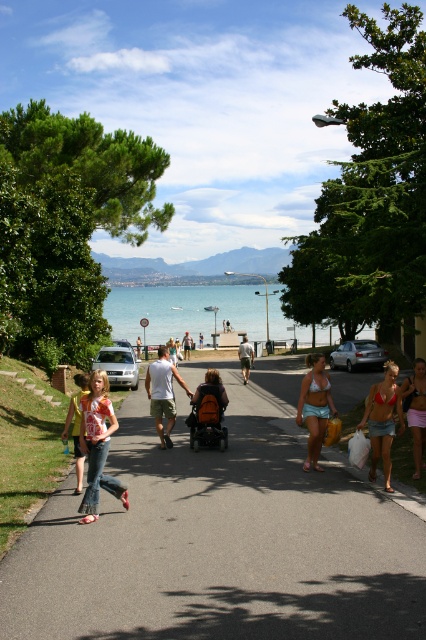
You are a pedestrian standing on the gray asphalt road at center and want to reach the orange fabric stroller at center. Which direction should you move in to get closer to the stroller?

The gray asphalt road at center is to the right of orange fabric stroller at center, so you should move to the left to reach the stroller.

In the scene shown: Based on the provided scene description, what does the point at coordinates (x=221, y=536) represent?

The point at coordinates (x=221, y=536) marks the gray asphalt road at center.

You are a photographer trying to capture a clear shot of the gray asphalt road at center and the teal fabric bikini top at center. Which object appears larger in the image?

The teal fabric bikini top at center appears larger than the gray asphalt road at center in the image.